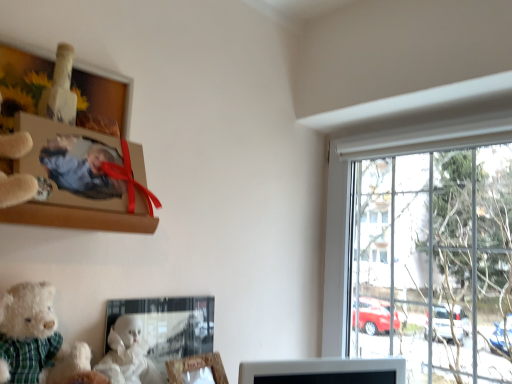
The width and height of the screenshot is (512, 384). I want to click on matte cardboard photo frame at upper left, positioned as the 1th picture frame in top-to-bottom order, so click(x=82, y=176).

I want to click on wooden picture frame at lower center, which is the 4th picture frame in top-to-bottom order, so click(196, 367).

Identify the location of wooden photo frame at upper left, the second picture frame when ordered from top to bottom. This screenshot has width=512, height=384. (72, 164).

From their relative heights in the image, would you say matte cardboard photo frame at upper left, positioned as the 1th picture frame in top-to-bottom order, is taller or shorter than matte glass picture frame at lower center, which ranks as the 2th picture frame in bottom-to-top order?

matte cardboard photo frame at upper left, positioned as the 1th picture frame in top-to-bottom order, is taller than matte glass picture frame at lower center, which ranks as the 2th picture frame in bottom-to-top order.

Does point (117, 89) appear closer or farther from the camera than point (206, 306)?

Clearly, point (117, 89) is closer to the camera than point (206, 306).

Is matte cardboard photo frame at upper left, the 4th picture frame from the bottom, facing away from matte glass picture frame at lower center, placed as the 3th picture frame when sorted from top to bottom?

matte cardboard photo frame at upper left, the 4th picture frame from the bottom, does not have its back to matte glass picture frame at lower center, placed as the 3th picture frame when sorted from top to bottom.

Is matte cardboard photo frame at upper left, positioned as the 1th picture frame in top-to-bottom order, thinner than matte glass picture frame at lower center, which ranks as the 2th picture frame in bottom-to-top order?

No, matte cardboard photo frame at upper left, positioned as the 1th picture frame in top-to-bottom order, is not thinner than matte glass picture frame at lower center, which ranks as the 2th picture frame in bottom-to-top order.

Would you say white fluffy teddy bear at lower left is a long distance from matte glass picture frame at lower center, which ranks as the 2th picture frame in bottom-to-top order?

No, white fluffy teddy bear at lower left is in close proximity to matte glass picture frame at lower center, which ranks as the 2th picture frame in bottom-to-top order.

What's the angular difference between white fluffy teddy bear at lower left and matte glass picture frame at lower center, which ranks as the 2th picture frame in bottom-to-top order,'s facing directions?

They differ by 11.6 degrees in their facing directions.

Is white fluffy teddy bear at lower left oriented away from matte glass picture frame at lower center, placed as the 3th picture frame when sorted from top to bottom?

No, white fluffy teddy bear at lower left is not facing the opposite direction of matte glass picture frame at lower center, placed as the 3th picture frame when sorted from top to bottom.

Considering the positions of objects white fluffy teddy bear at lower left and matte glass picture frame at lower center, placed as the 3th picture frame when sorted from top to bottom, in the image provided, who is more to the left, white fluffy teddy bear at lower left or matte glass picture frame at lower center, placed as the 3th picture frame when sorted from top to bottom,?

Positioned to the left is white fluffy teddy bear at lower left.

Which of these two, wooden photo frame at upper left, the second picture frame when ordered from top to bottom, or wooden picture frame at lower center, arranged as the 1th picture frame when ordered from the bottom, stands taller?

Standing taller between the two is wooden photo frame at upper left, the second picture frame when ordered from top to bottom.

From the image's perspective, which object appears higher, wooden photo frame at upper left, the second picture frame when ordered from top to bottom, or wooden picture frame at lower center, arranged as the 1th picture frame when ordered from the bottom?

wooden photo frame at upper left, the second picture frame when ordered from top to bottom.

The width and height of the screenshot is (512, 384). I want to click on the 2nd picture frame directly above the wooden picture frame at lower center, arranged as the 1th picture frame when ordered from the bottom (from a real-world perspective), so click(x=72, y=164).

Considering the relative positions of wooden photo frame at upper left, the second picture frame when ordered from top to bottom, and wooden picture frame at lower center, which is the 4th picture frame in top-to-bottom order, in the image provided, is wooden photo frame at upper left, the second picture frame when ordered from top to bottom, behind wooden picture frame at lower center, which is the 4th picture frame in top-to-bottom order,?

That is False.

Considering their positions, is wooden picture frame at lower center, arranged as the 1th picture frame when ordered from the bottom, located in front of or behind white fluffy teddy bear at lower left?

Visually, wooden picture frame at lower center, arranged as the 1th picture frame when ordered from the bottom, is located behind white fluffy teddy bear at lower left.

From a real-world perspective, is wooden picture frame at lower center, arranged as the 1th picture frame when ordered from the bottom, located beneath white fluffy teddy bear at lower left?

Indeed, from a real-world perspective, wooden picture frame at lower center, arranged as the 1th picture frame when ordered from the bottom, is positioned beneath white fluffy teddy bear at lower left.

Is point (169, 370) farther from viewer compared to point (1, 346)?

That is True.

Can you confirm if wooden picture frame at lower center, arranged as the 1th picture frame when ordered from the bottom, is bigger than white fluffy teddy bear at lower left?

Incorrect, wooden picture frame at lower center, arranged as the 1th picture frame when ordered from the bottom, is not larger than white fluffy teddy bear at lower left.

Is matte cardboard photo frame at upper left, the 4th picture frame from the bottom, not close to white fluffy teddy bear at lower left?

matte cardboard photo frame at upper left, the 4th picture frame from the bottom, is near white fluffy teddy bear at lower left, not far away.

From the image's perspective, which object appears higher, matte cardboard photo frame at upper left, the 4th picture frame from the bottom, or white fluffy teddy bear at lower left?

matte cardboard photo frame at upper left, the 4th picture frame from the bottom, from the image's perspective.

Relative to white fluffy teddy bear at lower left, is matte cardboard photo frame at upper left, positioned as the 1th picture frame in top-to-bottom order, in front or behind?

matte cardboard photo frame at upper left, positioned as the 1th picture frame in top-to-bottom order, is positioned farther from the viewer than white fluffy teddy bear at lower left.

Which is correct: matte cardboard photo frame at upper left, positioned as the 1th picture frame in top-to-bottom order, is inside white fluffy teddy bear at lower left, or outside of it?

matte cardboard photo frame at upper left, positioned as the 1th picture frame in top-to-bottom order, is not inside white fluffy teddy bear at lower left, it's outside.

Is wooden picture frame at lower center, which is the 4th picture frame in top-to-bottom order, positioned behind wooden photo frame at upper left, placed as the third picture frame when sorted from bottom to top?

Yes, it is behind wooden photo frame at upper left, placed as the third picture frame when sorted from bottom to top.

Considering the sizes of objects wooden picture frame at lower center, arranged as the 1th picture frame when ordered from the bottom, and wooden photo frame at upper left, the second picture frame when ordered from top to bottom, in the image provided, who is shorter, wooden picture frame at lower center, arranged as the 1th picture frame when ordered from the bottom, or wooden photo frame at upper left, the second picture frame when ordered from top to bottom,?

With less height is wooden picture frame at lower center, arranged as the 1th picture frame when ordered from the bottom.

Considering the positions of points (179, 378) and (105, 140), is point (179, 378) farther from camera compared to point (105, 140)?

Yes, point (179, 378) is farther from viewer.

Which picture frame is the 1st one when counting from the right side of the white fluffy teddy bear at lower left? Please provide its 2D coordinates.

[(72, 164)]

Is wooden photo frame at upper left, placed as the third picture frame when sorted from bottom to top, facing towards white fluffy teddy bear at lower left?

No, wooden photo frame at upper left, placed as the third picture frame when sorted from bottom to top, is not oriented towards white fluffy teddy bear at lower left.

Considering the relative sizes of wooden photo frame at upper left, the second picture frame when ordered from top to bottom, and white fluffy teddy bear at lower left in the image provided, is wooden photo frame at upper left, the second picture frame when ordered from top to bottom, taller than white fluffy teddy bear at lower left?

No.

I want to click on the 2nd picture frame counting from the left side of the matte glass picture frame at lower center, placed as the 3th picture frame when sorted from top to bottom, so click(x=82, y=176).

You are a GUI agent. You are given a task and a screenshot of the screen. Output one action in this format:
    pyautogui.click(x=<x>, y=<y>)
    Task: Click on the 1st picture frame below the white fluffy teddy bear at lower left (from the image's perspective)
    The height and width of the screenshot is (384, 512).
    Given the screenshot: What is the action you would take?
    pyautogui.click(x=169, y=325)

Based on their spatial positions, is wooden photo frame at upper left, the second picture frame when ordered from top to bottom, or matte cardboard photo frame at upper left, the 4th picture frame from the bottom, closer to matte glass picture frame at lower center, which ranks as the 2th picture frame in bottom-to-top order?

Based on the image, wooden photo frame at upper left, the second picture frame when ordered from top to bottom, appears to be nearer to matte glass picture frame at lower center, which ranks as the 2th picture frame in bottom-to-top order.

From the image, which object appears to be farther from wooden picture frame at lower center, which is the 4th picture frame in top-to-bottom order, white fluffy teddy bear at lower left or matte cardboard photo frame at upper left, positioned as the 1th picture frame in top-to-bottom order?

Among the two, matte cardboard photo frame at upper left, positioned as the 1th picture frame in top-to-bottom order, is located further to wooden picture frame at lower center, which is the 4th picture frame in top-to-bottom order.

Which object lies further to the anchor point wooden photo frame at upper left, the second picture frame when ordered from top to bottom, matte glass picture frame at lower center, which ranks as the 2th picture frame in bottom-to-top order, or wooden picture frame at lower center, arranged as the 1th picture frame when ordered from the bottom?

Among the two, wooden picture frame at lower center, arranged as the 1th picture frame when ordered from the bottom, is located further to wooden photo frame at upper left, the second picture frame when ordered from top to bottom.

Based on their spatial positions, is matte glass picture frame at lower center, placed as the 3th picture frame when sorted from top to bottom, or wooden photo frame at upper left, placed as the third picture frame when sorted from bottom to top, further from wooden picture frame at lower center, arranged as the 1th picture frame when ordered from the bottom?

wooden photo frame at upper left, placed as the third picture frame when sorted from bottom to top, lies further to wooden picture frame at lower center, arranged as the 1th picture frame when ordered from the bottom, than the other object.

Considering their positions, is matte cardboard photo frame at upper left, positioned as the 1th picture frame in top-to-bottom order, positioned further to matte glass picture frame at lower center, placed as the 3th picture frame when sorted from top to bottom, than white fluffy teddy bear at lower left?

matte cardboard photo frame at upper left, positioned as the 1th picture frame in top-to-bottom order, is positioned further to the anchor matte glass picture frame at lower center, placed as the 3th picture frame when sorted from top to bottom.

Based on the photo, based on their spatial positions, is white fluffy teddy bear at lower left or wooden picture frame at lower center, which is the 4th picture frame in top-to-bottom order, further from wooden photo frame at upper left, the second picture frame when ordered from top to bottom?

The object further to wooden photo frame at upper left, the second picture frame when ordered from top to bottom, is wooden picture frame at lower center, which is the 4th picture frame in top-to-bottom order.

Based on their spatial positions, is matte cardboard photo frame at upper left, the 4th picture frame from the bottom, or wooden picture frame at lower center, which is the 4th picture frame in top-to-bottom order, closer to matte glass picture frame at lower center, which ranks as the 2th picture frame in bottom-to-top order?

Among the two, wooden picture frame at lower center, which is the 4th picture frame in top-to-bottom order, is located nearer to matte glass picture frame at lower center, which ranks as the 2th picture frame in bottom-to-top order.

When comparing their distances from white fluffy teddy bear at lower left, does matte cardboard photo frame at upper left, positioned as the 1th picture frame in top-to-bottom order, or wooden picture frame at lower center, which is the 4th picture frame in top-to-bottom order, seem further?

Based on the image, wooden picture frame at lower center, which is the 4th picture frame in top-to-bottom order, appears to be further to white fluffy teddy bear at lower left.

At what (x,y) coordinates should I click in order to perform the action: click on teddy bear between matte cardboard photo frame at upper left, the 4th picture frame from the bottom, and matte glass picture frame at lower center, which ranks as the 2th picture frame in bottom-to-top order, in the vertical direction. Please return your answer as a coordinate pair (x, y). This screenshot has width=512, height=384. Looking at the image, I should click on (27, 332).

In order to click on picture frame between matte cardboard photo frame at upper left, the 4th picture frame from the bottom, and matte glass picture frame at lower center, which ranks as the 2th picture frame in bottom-to-top order, vertically in this screenshot , I will do `click(72, 164)`.

I want to click on picture frame between matte cardboard photo frame at upper left, the 4th picture frame from the bottom, and white fluffy teddy bear at lower left vertically, so click(x=72, y=164).

Locate an element on the screen. Image resolution: width=512 pixels, height=384 pixels. picture frame between wooden photo frame at upper left, placed as the third picture frame when sorted from bottom to top, and wooden picture frame at lower center, arranged as the 1th picture frame when ordered from the bottom, vertically is located at coordinates (169, 325).